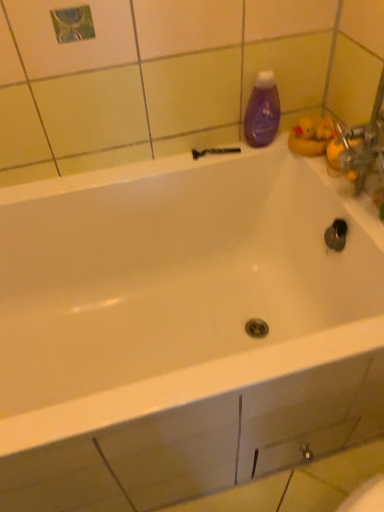
This screenshot has height=512, width=384. Identify the location of blank area to the left of purple glossy bottle at upper right. (212, 155).